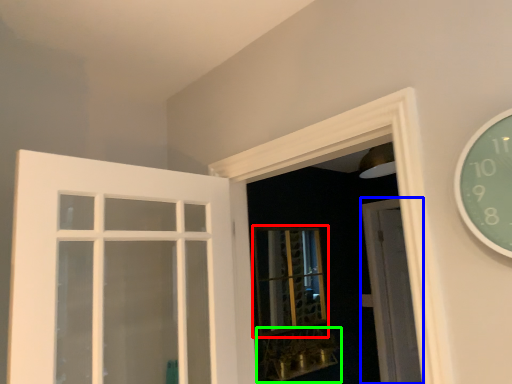
Question: Which is farther away from bay window (highlighted by a red box)? door (highlighted by a blue box) or window sill (highlighted by a green box)?

Choices:
 (A) door
 (B) window sill

Answer: (A)